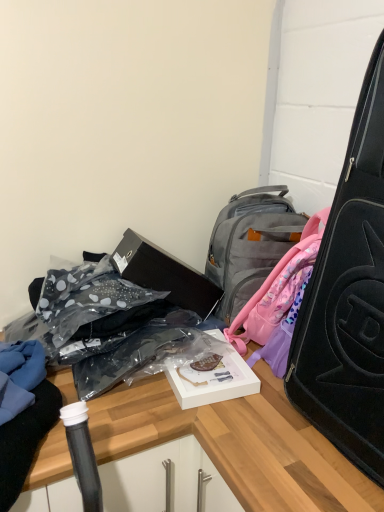
Question: Does clear plastic bag at lower left have a greater height compared to black matte suitcase at right?

Choices:
 (A) yes
 (B) no

Answer: (B)

Question: Is clear plastic bag at lower left positioned with its back to black matte suitcase at right?

Choices:
 (A) yes
 (B) no

Answer: (B)

Question: Is there a large distance between clear plastic bag at lower left and black matte suitcase at right?

Choices:
 (A) no
 (B) yes

Answer: (A)

Question: From a real-world perspective, is clear plastic bag at lower left under black matte suitcase at right?

Choices:
 (A) yes
 (B) no

Answer: (A)

Question: Is clear plastic bag at lower left positioned beyond the bounds of black matte suitcase at right?

Choices:
 (A) no
 (B) yes

Answer: (B)

Question: Does point (175, 281) appear closer or farther from the camera than point (364, 420)?

Choices:
 (A) closer
 (B) farther

Answer: (B)

Question: In terms of width, does black matte box at center look wider or thinner when compared to black matte suitcase at right?

Choices:
 (A) wide
 (B) thin

Answer: (B)

Question: Considering the relative positions of black matte box at center and black matte suitcase at right in the image provided, is black matte box at center to the left or to the right of black matte suitcase at right?

Choices:
 (A) left
 (B) right

Answer: (A)

Question: In terms of height, does black matte box at center look taller or shorter compared to black matte suitcase at right?

Choices:
 (A) short
 (B) tall

Answer: (A)

Question: Considering the positions of gray fabric backpack at upper center and black matte box at center in the image, is gray fabric backpack at upper center wider or thinner than black matte box at center?

Choices:
 (A) thin
 (B) wide

Answer: (B)

Question: From a real-world perspective, is gray fabric backpack at upper center physically located above or below black matte box at center?

Choices:
 (A) below
 (B) above

Answer: (B)

Question: Is point (317, 230) closer or farther from the camera than point (177, 291)?

Choices:
 (A) farther
 (B) closer

Answer: (B)

Question: Is gray fabric backpack at upper center taller or shorter than black matte box at center?

Choices:
 (A) tall
 (B) short

Answer: (A)

Question: Is black matte box at center to the left or to the right of white matte box at center in the image?

Choices:
 (A) right
 (B) left

Answer: (B)

Question: Is black matte box at center in front of or behind white matte box at center in the image?

Choices:
 (A) front
 (B) behind

Answer: (B)